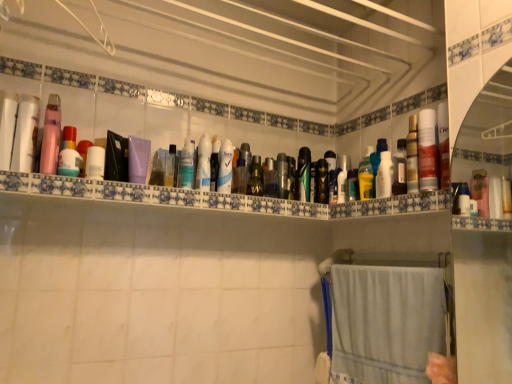
Question: Is metallic silver can at center, the twelfth toiletry positioned from the left, smaller than black matte hairbrush at center, arranged as the seventh toiletry when viewed from the right?

Choices:
 (A) yes
 (B) no

Answer: (A)

Question: Considering the relative sizes of metallic silver can at center, the twelfth toiletry positioned from the left, and black matte hairbrush at center, placed as the sixteenth toiletry when sorted from left to right, in the image provided, is metallic silver can at center, the twelfth toiletry positioned from the left, thinner than black matte hairbrush at center, placed as the sixteenth toiletry when sorted from left to right,?

Choices:
 (A) yes
 (B) no

Answer: (A)

Question: Can you confirm if metallic silver can at center, the twelfth toiletry positioned from the left, is positioned to the left of black matte hairbrush at center, arranged as the seventh toiletry when viewed from the right?

Choices:
 (A) no
 (B) yes

Answer: (B)

Question: Is metallic silver can at center, the 11th toiletry viewed from the right, oriented away from black matte hairbrush at center, placed as the sixteenth toiletry when sorted from left to right?

Choices:
 (A) no
 (B) yes

Answer: (A)

Question: From the image's perspective, would you say metallic silver can at center, the 11th toiletry viewed from the right, is shown under black matte hairbrush at center, placed as the sixteenth toiletry when sorted from left to right?

Choices:
 (A) yes
 (B) no

Answer: (B)

Question: Is metallic silver can at center, the 11th toiletry viewed from the right, completely or partially outside of black matte hairbrush at center, arranged as the seventh toiletry when viewed from the right?

Choices:
 (A) yes
 (B) no

Answer: (A)

Question: Would you consider metallic silver can at center, the 11th toiletry viewed from the right, to be distant from white matte deodorant at center, the 14th toiletry in the right-to-left sequence?

Choices:
 (A) no
 (B) yes

Answer: (A)

Question: From a real-world perspective, does metallic silver can at center, the 11th toiletry viewed from the right, stand above white matte deodorant at center, the 14th toiletry in the right-to-left sequence?

Choices:
 (A) no
 (B) yes

Answer: (A)

Question: Considering the relative sizes of metallic silver can at center, the 11th toiletry viewed from the right, and white matte deodorant at center, the 14th toiletry in the right-to-left sequence, in the image provided, is metallic silver can at center, the 11th toiletry viewed from the right, bigger than white matte deodorant at center, the 14th toiletry in the right-to-left sequence,?

Choices:
 (A) no
 (B) yes

Answer: (A)

Question: Is metallic silver can at center, the twelfth toiletry positioned from the left, shorter than white matte deodorant at center, the 14th toiletry in the right-to-left sequence?

Choices:
 (A) no
 (B) yes

Answer: (B)

Question: Are metallic silver can at center, the twelfth toiletry positioned from the left, and white matte deodorant at center, the 14th toiletry in the right-to-left sequence, making contact?

Choices:
 (A) yes
 (B) no

Answer: (B)

Question: From the image's perspective, is metallic silver can at center, the 11th toiletry viewed from the right, located above white matte deodorant at center, which ranks as the ninth toiletry in left-to-right order?

Choices:
 (A) yes
 (B) no

Answer: (B)

Question: Can pink matte lotion at upper left, the 21th toiletry in the right-to-left sequence, be found inside matte black can at center, which is the 6th toiletry from right to left?

Choices:
 (A) yes
 (B) no

Answer: (B)